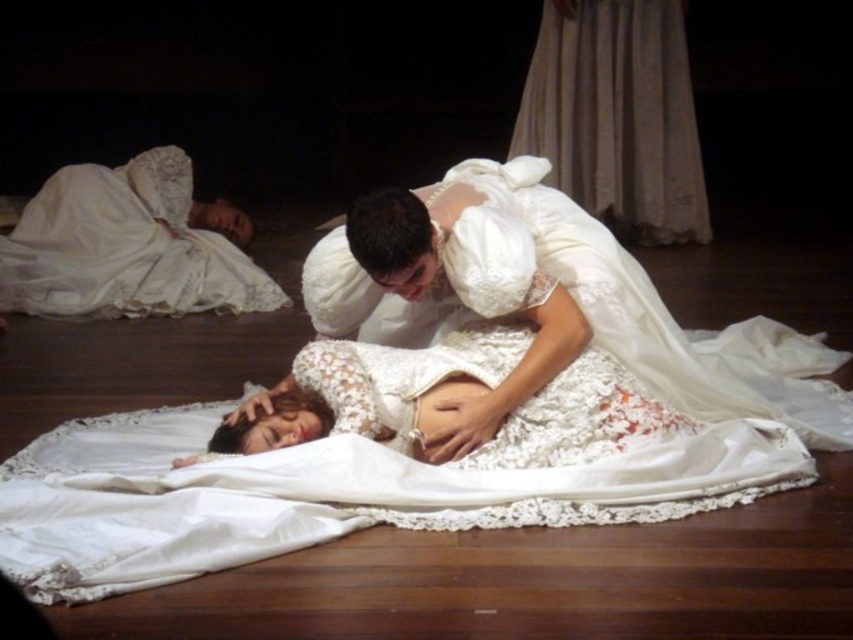
You are a stagehand preparing to lift the smooth white belly at center from under the white lace gown at center. Can you safely lift it without disturbing the gown?

The white lace gown at center is positioned over the smooth white belly at center, so lifting the smooth white belly at center might cause the gown to shift or move. Proceed with caution to avoid disrupting the gown.

You are an audience member sitting in the front row of the theater. You want to see both the white lace dress at upper left and the smooth white belly at center. Which object is blocking your view of the other?

The smooth white belly at center is behind the white lace dress at upper left, so the white lace dress at upper left is blocking the view of the smooth white belly at center.